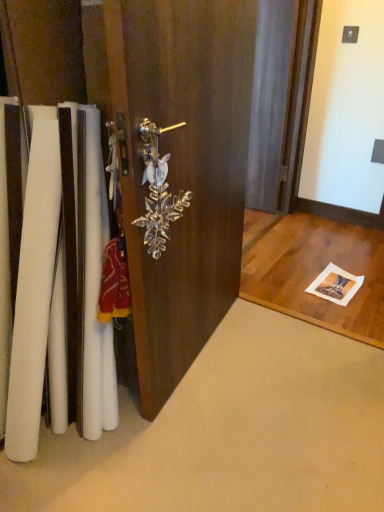
Question: In terms of width, does clear glass snowflake at center look wider or thinner when compared to clear crystal snowflake at center?

Choices:
 (A) wide
 (B) thin

Answer: (A)

Question: Do you think clear glass snowflake at center is within clear crystal snowflake at center, or outside of it?

Choices:
 (A) outside
 (B) inside

Answer: (A)

Question: Is clear glass snowflake at center in front of or behind clear crystal snowflake at center in the image?

Choices:
 (A) behind
 (B) front

Answer: (B)

Question: Considering the positions of point (147, 181) and point (162, 373), is point (147, 181) closer or farther from the camera than point (162, 373)?

Choices:
 (A) farther
 (B) closer

Answer: (B)

Question: From a real-world perspective, is clear crystal snowflake at center positioned above or below clear glass snowflake at center?

Choices:
 (A) below
 (B) above

Answer: (B)

Question: In terms of width, does clear crystal snowflake at center look wider or thinner when compared to clear glass snowflake at center?

Choices:
 (A) thin
 (B) wide

Answer: (A)

Question: In the image, is clear crystal snowflake at center on the left side or the right side of clear glass snowflake at center?

Choices:
 (A) right
 (B) left

Answer: (B)